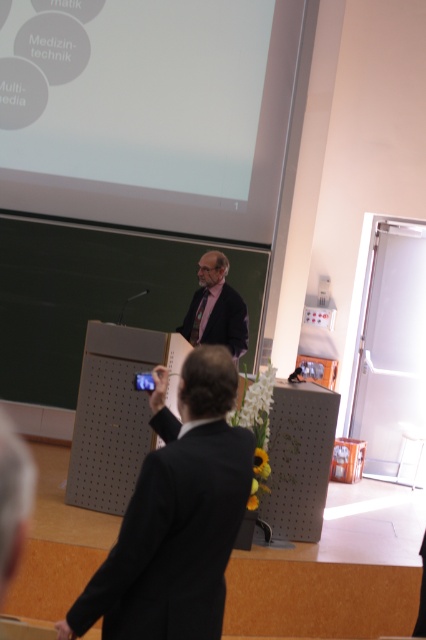
You are standing in the lecture hall and want to determine the distance between two points marked in the image. The first point is at coordinate point (198, 496) and the second is at coordinate point (3, 189). Based on the scene description, which point is nearer to you?

Point (198, 496) is closer to the camera than point (3, 189), so the first point is nearer to you.

You are a stagehand in the lecture hall and need to place a 3.5 meter long extension cord from the black matte suit at center to the dark suit at center. Will the cord be long enough to reach between them?

The distance between the black matte suit at center and the dark suit at center is 2.74 meters. The 3.5 meter cord is longer than the distance, so it will be sufficient to reach between them.

You are attending a presentation and notice the black matte suit at center and the white matte projection screen at upper center. Which object is closer to the audience sitting in the front row?

The black matte suit at center is closer to the audience sitting in the front row because it is in front of the white matte projection screen at upper center.